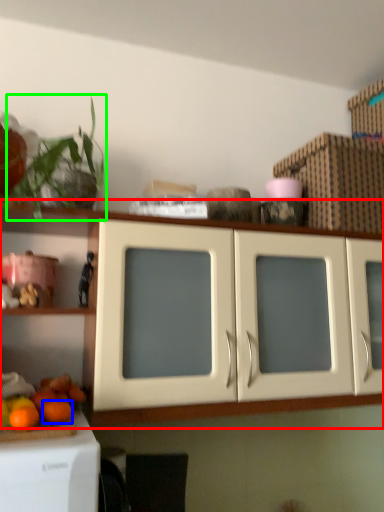
Question: Considering the real-world distances, which object is closest to cabinetry (highlighted by a red box)? orange (highlighted by a blue box) or plant (highlighted by a green box).

Choices:
 (A) orange
 (B) plant

Answer: (B)